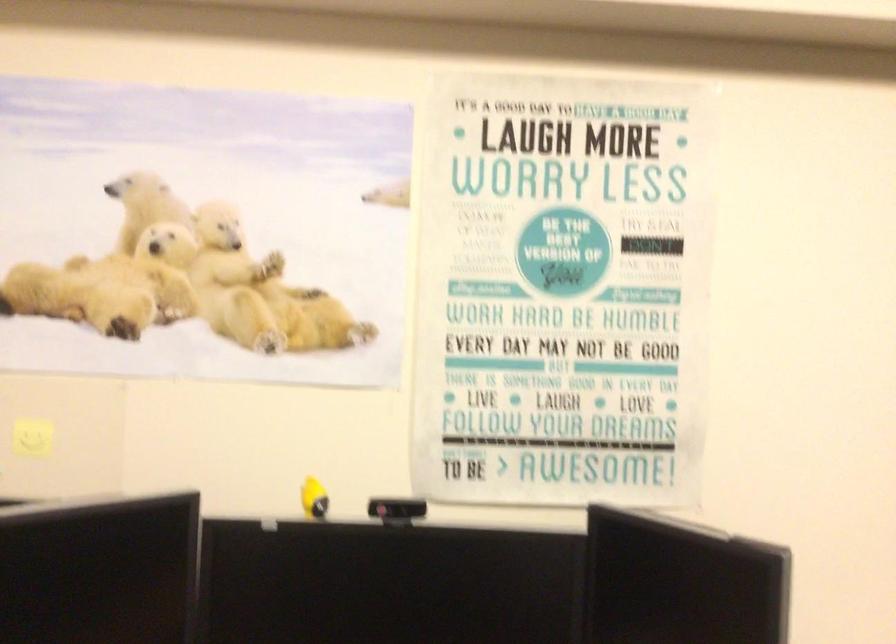
The location [397,511] corresponds to which object?

This point indicates the small black webcam.